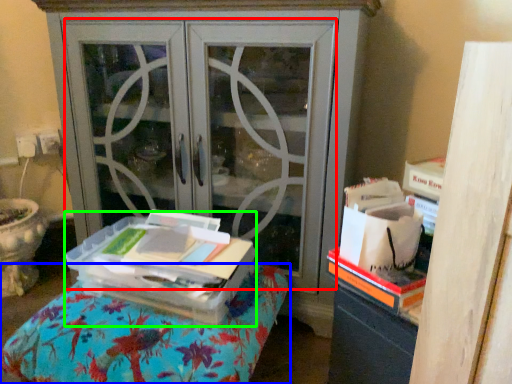
Question: Which object is positioned closest to screen door (highlighted by a red box)? Select from furniture (highlighted by a blue box) and cardboard box (highlighted by a green box).

Choices:
 (A) furniture
 (B) cardboard box

Answer: (B)